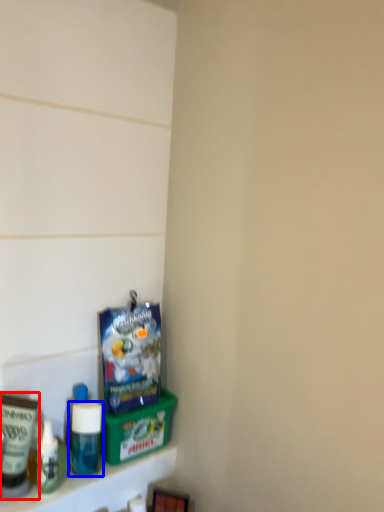
Question: Among these objects, which one is nearest to the camera, toiletry (highlighted by a red box) or bottle (highlighted by a blue box)?

Choices:
 (A) toiletry
 (B) bottle

Answer: (A)